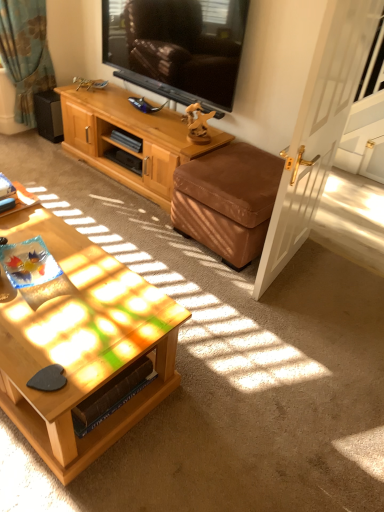
Find the location of a particular element. The height and width of the screenshot is (512, 384). vacant space to the right of brown leather ottoman at lower right is located at coordinates (337, 269).